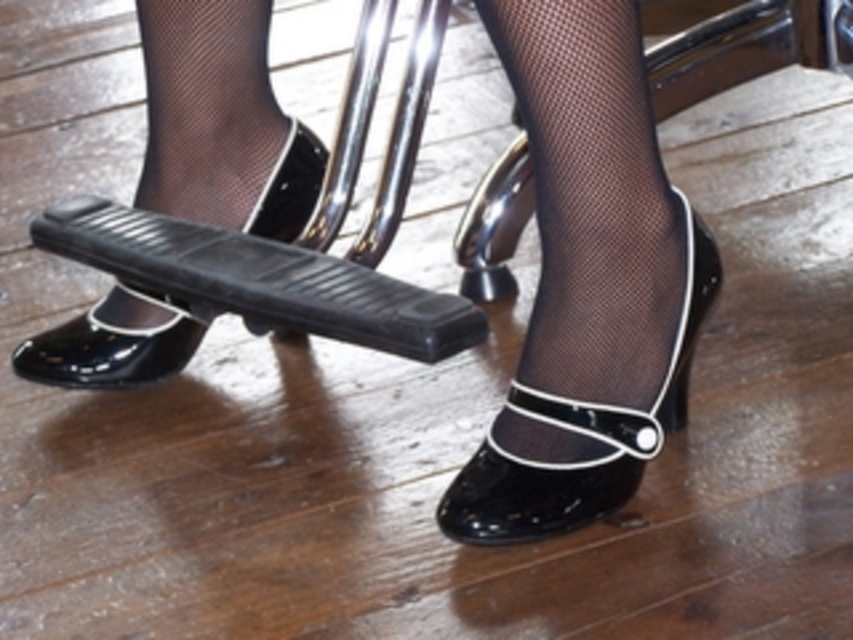
Question: Among these objects, which one is farthest from the camera?

Choices:
 (A) glossy patent leather shoe at lower left
 (B) black patent leather shoe at center

Answer: (A)

Question: Which object appears farthest from the camera in this image?

Choices:
 (A) black patent leather shoe at center
 (B) glossy patent leather shoe at lower left

Answer: (B)

Question: Among these objects, which one is farthest from the camera?

Choices:
 (A) black patent leather shoe at center
 (B) glossy patent leather shoe at lower left

Answer: (B)

Question: Is black patent leather shoe at center wider than glossy patent leather shoe at lower left?

Choices:
 (A) yes
 (B) no

Answer: (B)

Question: Is black patent leather shoe at center to the left of glossy patent leather shoe at lower left from the viewer's perspective?

Choices:
 (A) no
 (B) yes

Answer: (A)

Question: Does black patent leather shoe at center appear on the right side of glossy patent leather shoe at lower left?

Choices:
 (A) no
 (B) yes

Answer: (B)